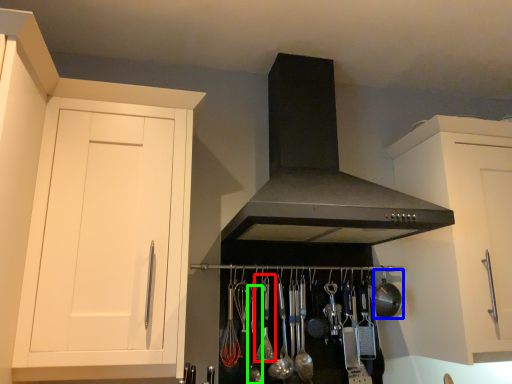
Question: Based on their relative distances, which object is farther from utensil (highlighted by a red box)? Choose from appliance (highlighted by a blue box) and utensil (highlighted by a green box).

Choices:
 (A) appliance
 (B) utensil

Answer: (A)